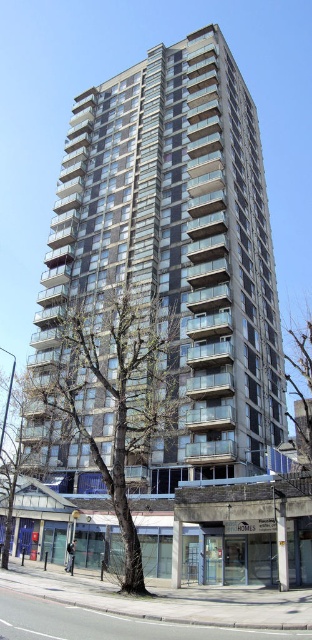
Question: Which point appears closest to the camera in this image?

Choices:
 (A) (147, 324)
 (B) (9, 401)
 (C) (302, 396)
 (D) (219, 289)

Answer: (D)

Question: Considering the real-world distances, which object is closest to the bare wood tree at center?

Choices:
 (A) green leafy tree at lower left
 (B) green leafy tree at center

Answer: (A)

Question: Is glassy concrete building at center above bare wood tree at center?

Choices:
 (A) yes
 (B) no

Answer: (A)

Question: Is glassy concrete building at center positioned before green leafy tree at lower left?

Choices:
 (A) no
 (B) yes

Answer: (A)

Question: Does green leafy tree at lower left have a lesser width compared to green leafy tree at center?

Choices:
 (A) yes
 (B) no

Answer: (B)

Question: Among these objects, which one is nearest to the camera?

Choices:
 (A) glassy concrete building at center
 (B) bare wood tree at center
 (C) green leafy tree at center

Answer: (B)